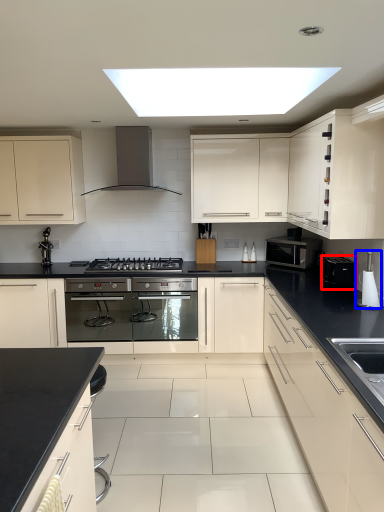
Question: Which of the following is the farthest to the observer, appliance (highlighted by a red box) or appliance (highlighted by a blue box)?

Choices:
 (A) appliance
 (B) appliance

Answer: (A)